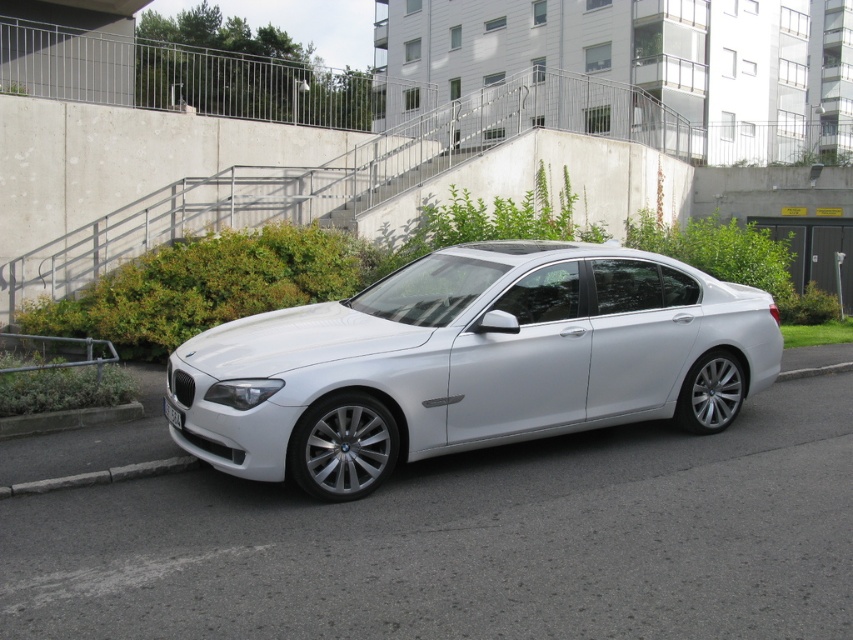
Is gray concrete curb at lower left below white plastic license plate at lower center?

Yes, gray concrete curb at lower left is below white plastic license plate at lower center.

Between gray concrete curb at lower left and white plastic license plate at lower center, which one appears on the left side from the viewer's perspective?

gray concrete curb at lower left

Find the location of a particular element. This screenshot has height=640, width=853. gray concrete curb at lower left is located at coordinates (102, 476).

Between white metallic car at center and white plastic license plate at lower center, which one has more height?

white metallic car at center is taller.

Who is higher up, white metallic car at center or white plastic license plate at lower center?

white metallic car at center

This screenshot has height=640, width=853. What do you see at coordinates (469, 362) in the screenshot?
I see `white metallic car at center` at bounding box center [469, 362].

Identify the location of white metallic car at center. The height and width of the screenshot is (640, 853). (469, 362).

Between white metallic car at center and gray concrete curb at lower left, which one has less height?

Standing shorter between the two is gray concrete curb at lower left.

Is point (672, 275) farther from camera compared to point (55, 484)?

Yes, it is.

I want to click on white metallic car at center, so pos(469,362).